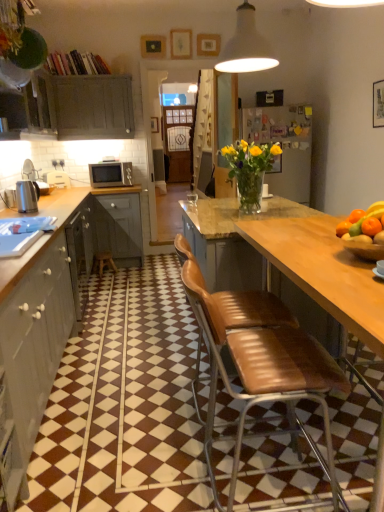
Find the location of a particular element. The width and height of the screenshot is (384, 512). vacant space situated on the left part of brown leather chair at center, which appears as the second chair when viewed from the front is located at coordinates (148, 433).